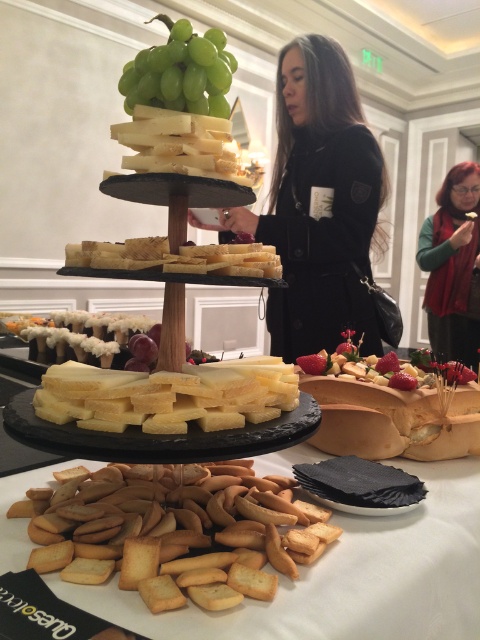
Is the position of black matte jacket at center more distant than that of green velvet scarf at upper right?

No.

Does black matte jacket at center appear on the left side of green velvet scarf at upper right?

Yes, black matte jacket at center is to the left of green velvet scarf at upper right.

What do you see at coordinates (320, 204) in the screenshot? I see `black matte jacket at center` at bounding box center [320, 204].

The image size is (480, 640). Identify the location of black matte jacket at center. (320, 204).

Can you confirm if golden crisp crackers at lower center is positioned below green velvet scarf at upper right?

Correct, golden crisp crackers at lower center is located below green velvet scarf at upper right.

Is point (190, 529) positioned in front of point (444, 195)?

Yes, point (190, 529) is closer to viewer.

Is point (37, 528) behind point (452, 209)?

No, it is in front of (452, 209).

You are a GUI agent. You are given a task and a screenshot of the screen. Output one action in this format:
    pyautogui.click(x=<x>, y=<y>)
    Task: Click on the golden crisp crackers at lower center
    
    Given the screenshot: What is the action you would take?
    pyautogui.click(x=182, y=534)

The image size is (480, 640). I want to click on shiny gold tray at center, so click(x=393, y=419).

From the picture: Can you confirm if shiny gold tray at center is wider than green matte grapes at upper center?

Yes, shiny gold tray at center is wider than green matte grapes at upper center.

Is point (454, 394) positioned after point (128, 76)?

Yes, point (454, 394) is behind point (128, 76).

Locate an element on the screen. This screenshot has width=480, height=640. shiny gold tray at center is located at coordinates (393, 419).